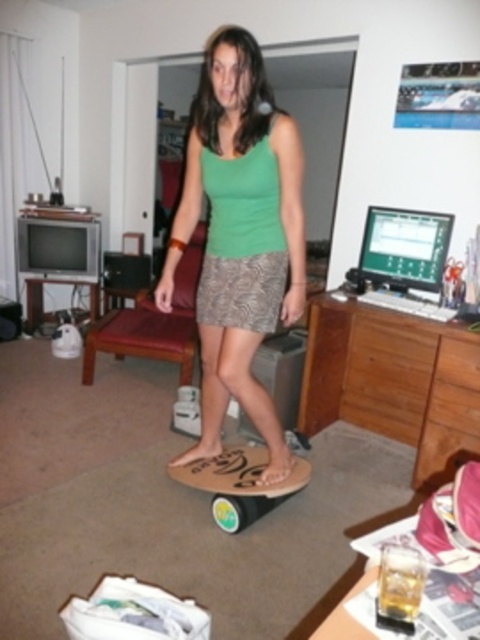
Question: Can you confirm if green fabric tank top at center is positioned below wooden skateboard at center?

Choices:
 (A) no
 (B) yes

Answer: (A)

Question: Can you confirm if green fabric tank top at center is smaller than wooden skateboard at center?

Choices:
 (A) no
 (B) yes

Answer: (A)

Question: Which object is positioned farthest from the green fabric tank top at center?

Choices:
 (A) wooden dresser at center-right
 (B) wooden skateboard at center

Answer: (A)

Question: Which point appears farthest from the camera in this image?

Choices:
 (A) (266, 512)
 (B) (350, 417)
 (C) (204, 296)

Answer: (B)

Question: Does green fabric tank top at center have a lesser width compared to wooden dresser at center-right?

Choices:
 (A) yes
 (B) no

Answer: (A)

Question: Which object is farther from the camera taking this photo?

Choices:
 (A) wooden dresser at center-right
 (B) green fabric tank top at center
 (C) wooden skateboard at center

Answer: (A)